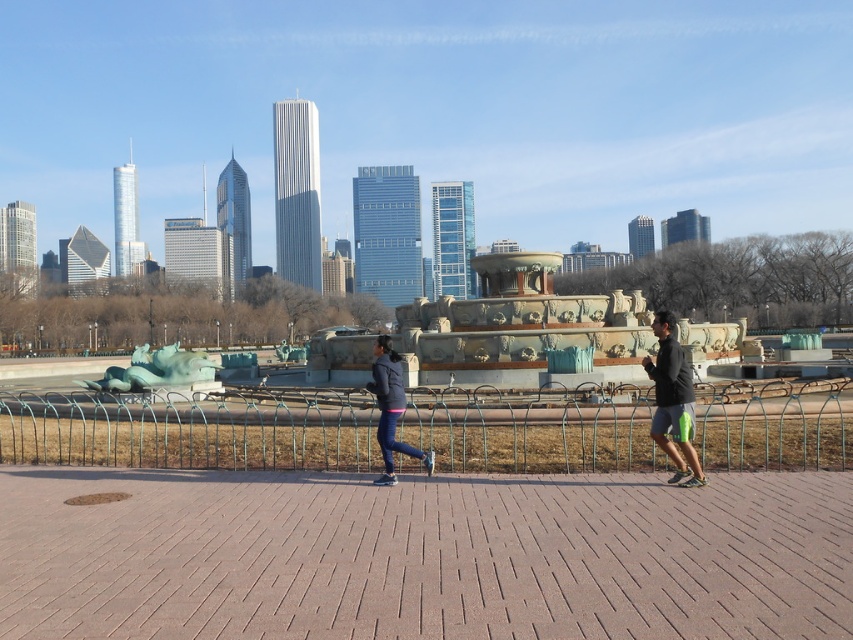
You are standing at the point marked as point (192, 429) in the image. What object are you facing?

The point (192, 429) corresponds to the green metal fence at center, so you are facing the green metal fence at center.

You are an urban planner assessing the space between the green metal fence at center and the dark gray fabric jacket at right for a new bench installation. Considering their sizes, which object would require more space to accommodate the bench?

The green metal fence at center has a larger size compared to the dark gray fabric jacket at right, so it would require more space to accommodate the bench installation.

You are a photographer trying to capture both the dark gray fabric jacket at right and the matte black jacket at center in the same frame. Which jacket should you focus on to ensure both are visible without moving the camera?

The dark gray fabric jacket at right is wider than the matte black jacket at center, so focusing on the wider jacket will ensure both are visible in the frame.